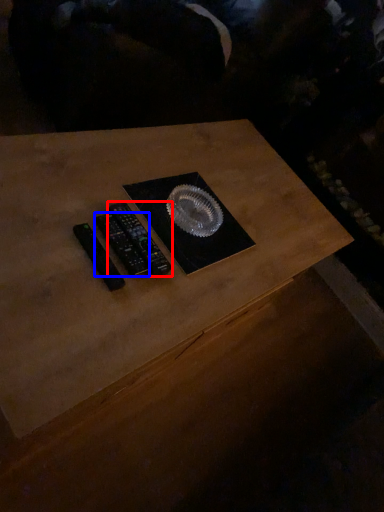
Question: Which object is closer to the camera taking this photo, control (highlighted by a red box) or control (highlighted by a blue box)?

Choices:
 (A) control
 (B) control

Answer: (B)